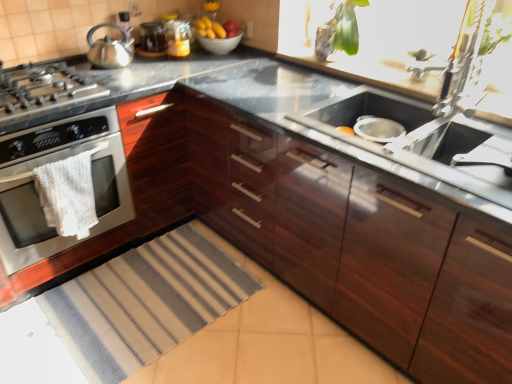
The image size is (512, 384). Find the location of `vacant area on top of striped fabric rug at lower left (from a real-world perspective)`. vacant area on top of striped fabric rug at lower left (from a real-world perspective) is located at coordinates (x=113, y=317).